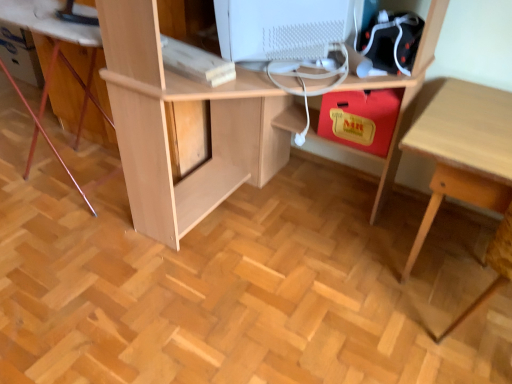
Measure the distance between light wood computer desk at lower left and camera.

light wood computer desk at lower left and camera are 1.51 meters apart from each other.

Find the location of a particular element. The image size is (512, 384). white matte computer monitor at upper center is located at coordinates (281, 28).

Is point (162, 224) positioned after point (239, 32)?

Yes, point (162, 224) is behind point (239, 32).

Identify the location of desk below the white matte computer monitor at upper center (from the image's perspective). 166,115.

From the image's perspective, between light wood desk at center and white matte computer monitor at upper center, which one is located above?

From the image's view, white matte computer monitor at upper center is above.

Does light wood desk at center have a lesser width compared to white matte computer monitor at upper center?

No.

Relative to light wood table at lower right, is white matte computer monitor at upper center in front or behind?

Clearly, white matte computer monitor at upper center is behind light wood table at lower right.

From the image's perspective, would you say white matte computer monitor at upper center is shown under light wood table at lower right?

No.

Is white matte computer monitor at upper center looking in the opposite direction of light wood table at lower right?

No, white matte computer monitor at upper center is not facing away from light wood table at lower right.

Considering the relative positions of white matte computer monitor at upper center and light wood table at lower right in the image provided, is white matte computer monitor at upper center to the right of light wood table at lower right from the viewer's perspective?

No, white matte computer monitor at upper center is not to the right of light wood table at lower right.

Is light wood desk at center spatially inside light wood computer desk at lower left, or outside of it?

light wood desk at center lies outside light wood computer desk at lower left.

In order to click on computer desk that appears behind the light wood desk at center in this screenshot , I will do `click(54, 53)`.

Which is more to the left, light wood desk at center or light wood computer desk at lower left?

Positioned to the left is light wood computer desk at lower left.

Is light wood desk at center with light wood computer desk at lower left?

light wood desk at center is not next to light wood computer desk at lower left, and they're not touching.

Considering the sizes of objects light wood desk at center and light wood table at lower right in the image provided, who is shorter, light wood desk at center or light wood table at lower right?

light wood table at lower right is shorter.

Which is in front, point (148, 119) or point (482, 161)?

Point (482, 161)

In the image, is light wood desk at center on the left side or the right side of light wood table at lower right?

In the image, light wood desk at center appears on the left side of light wood table at lower right.

Which of these two, light wood desk at center or light wood table at lower right, is smaller?

light wood table at lower right.

Considering the positions of objects light wood computer desk at lower left and light wood table at lower right in the image provided, who is behind, light wood computer desk at lower left or light wood table at lower right?

light wood computer desk at lower left is behind.

Based on their sizes in the image, would you say light wood computer desk at lower left is bigger or smaller than light wood table at lower right?

light wood computer desk at lower left is bigger than light wood table at lower right.

How much distance is there between light wood computer desk at lower left and light wood table at lower right?

A distance of 1.41 meters exists between light wood computer desk at lower left and light wood table at lower right.

Where is `table located below the light wood computer desk at lower left (from the image's perspective)`? table located below the light wood computer desk at lower left (from the image's perspective) is located at coordinates (463, 148).

Does point (502, 143) lie in front of point (104, 27)?

Yes, point (502, 143) is in front of point (104, 27).

Is light wood table at lower right bigger than light wood desk at center?

Incorrect, light wood table at lower right is not larger than light wood desk at center.

Is light wood table at lower right facing towards light wood desk at center?

No, light wood table at lower right is not turned towards light wood desk at center.

Is light wood table at lower right in contact with white matte computer monitor at upper center?

They are not placed beside each other.

Which is closer to the camera, (467, 121) or (269, 39)?

Point (467, 121) is farther from the camera than point (269, 39).

Considering the positions of objects light wood table at lower right and white matte computer monitor at upper center in the image provided, who is in front, light wood table at lower right or white matte computer monitor at upper center?

light wood table at lower right.

Between light wood table at lower right and white matte computer monitor at upper center, which one appears on the left side from the viewer's perspective?

white matte computer monitor at upper center is more to the left.

Identify the location of desk located underneath the white matte computer monitor at upper center (from a real-world perspective). (166, 115).

At what (x,y) coordinates should I click in order to perform the action: click on computer monitor behind the light wood table at lower right. Please return your answer as a coordinate pair (x, y). This screenshot has height=384, width=512. Looking at the image, I should click on (281, 28).

From the image, which object appears to be nearer to light wood computer desk at lower left, white matte computer monitor at upper center or light wood table at lower right?

Among the two, white matte computer monitor at upper center is located nearer to light wood computer desk at lower left.

Estimate the real-world distances between objects in this image. Which object is further from light wood desk at center, light wood computer desk at lower left or white matte computer monitor at upper center?

light wood computer desk at lower left is further to light wood desk at center.

Which object lies further to the anchor point light wood table at lower right, white matte computer monitor at upper center or light wood computer desk at lower left?

Among the two, light wood computer desk at lower left is located further to light wood table at lower right.

When comparing their distances from light wood table at lower right, does light wood computer desk at lower left or light wood desk at center seem closer?

light wood desk at center is positioned closer to the anchor light wood table at lower right.

Looking at the image, which one is located further to white matte computer monitor at upper center, light wood table at lower right or light wood desk at center?

light wood table at lower right.

Considering their positions, is white matte computer monitor at upper center positioned closer to light wood desk at center than light wood computer desk at lower left?

white matte computer monitor at upper center.

Which object lies nearer to the anchor point light wood table at lower right, white matte computer monitor at upper center or light wood desk at center?

light wood desk at center is positioned closer to the anchor light wood table at lower right.

When comparing their distances from white matte computer monitor at upper center, does light wood computer desk at lower left or light wood table at lower right seem further?

light wood computer desk at lower left.

Identify the location of computer monitor between light wood computer desk at lower left and light wood desk at center in the horizontal direction. (281, 28).

You are a GUI agent. You are given a task and a screenshot of the screen. Output one action in this format:
    pyautogui.click(x=<x>, y=<y>)
    Task: Click on the desk situated between white matte computer monitor at upper center and light wood table at lower right from left to right
    
    Given the screenshot: What is the action you would take?
    pyautogui.click(x=166, y=115)

Where is `desk between light wood computer desk at lower left and light wood table at lower right from left to right`? desk between light wood computer desk at lower left and light wood table at lower right from left to right is located at coordinates (166, 115).

Identify the location of computer monitor between light wood computer desk at lower left and light wood table at lower right in the horizontal direction. (281, 28).